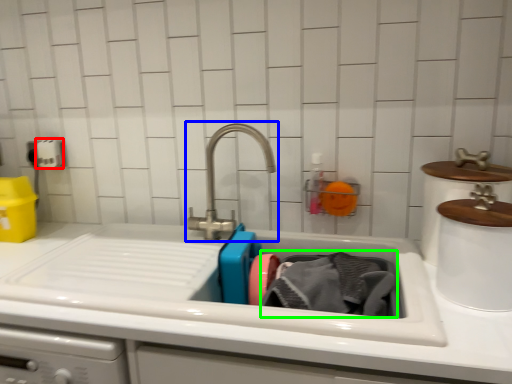
Question: Which object is positioned closest to toilet paper (highlighted by a red box)? Select from tap (highlighted by a blue box) and clothing (highlighted by a green box).

Choices:
 (A) tap
 (B) clothing

Answer: (A)